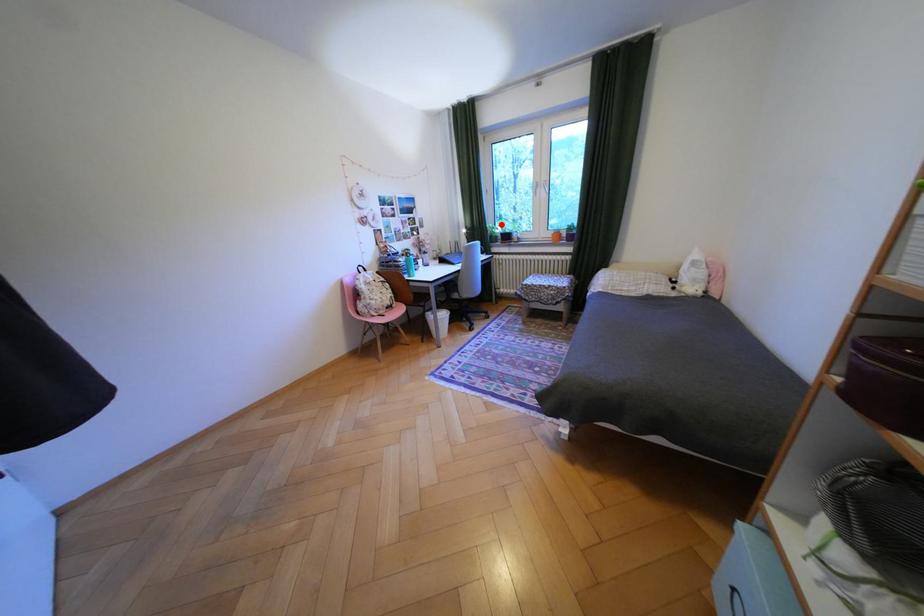
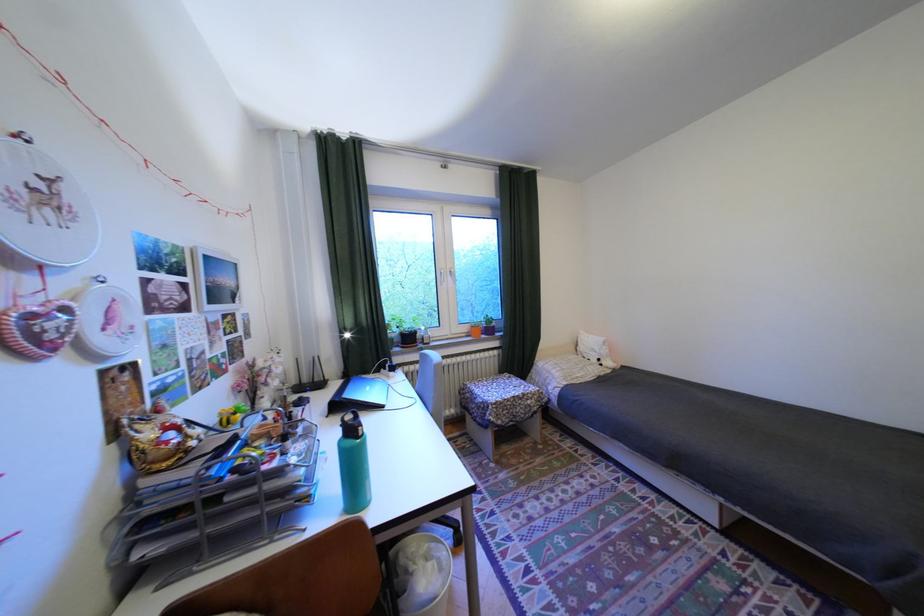
Question: A red point is marked in image1. In image2, is the corresponding 3D point closer to the camera or farther? Reply with the corresponding letter.

Choices:
 (A) The corresponding 3D point is closer.
 (B) The corresponding 3D point is farther.

Answer: (B)